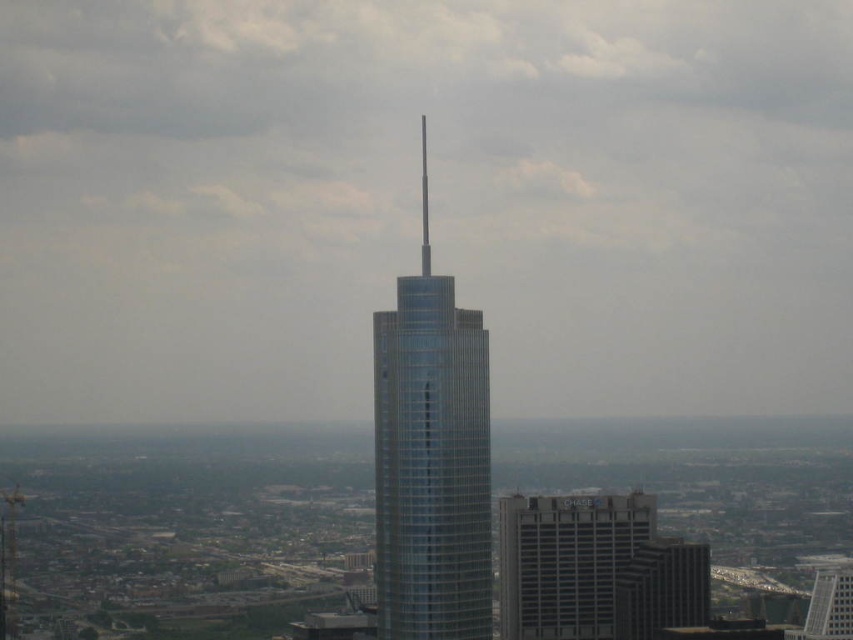
You are a city planner assessing the skyline. You need to determine if the gray concrete building at lower center can be seen from the glassy silver skyscraper at lower right. Based on their sizes and positions, what do you conclude?

The gray concrete building at lower center is larger in size than the glassy silver skyscraper at lower right. Since the gray concrete building is larger, it might block the view from the glassy silver skyscraper at lower right, making it possible that the gray concrete building at lower center cannot be seen from there.

You are standing in the city and looking at the skyscraper. There are two points marked on the building. The first point is at coordinates point (525, 580) and the second is at point (647, 557). Which point is closer to you?

Point (525, 580) is closer to the camera than point (647, 557), so the first point is closer to you.

You are an architect reviewing a city model. You notice the glassy silver tower at center and the glassy silver skyscraper at lower right. Which one is positioned higher in the city model?

The glassy silver tower at center is positioned higher than the glassy silver skyscraper at lower right because it is above it in the image.